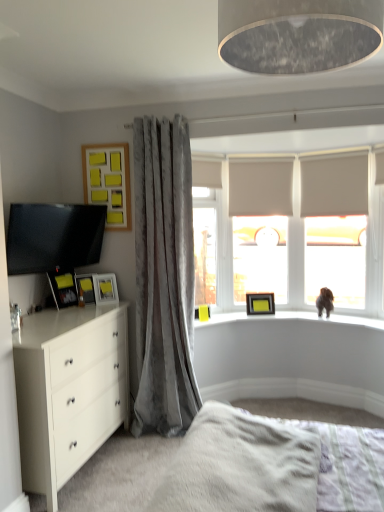
I want to click on vacant area that is in front of matte black picture frame at left, marked as the second picture frame in a top-to-bottom arrangement, so click(x=56, y=312).